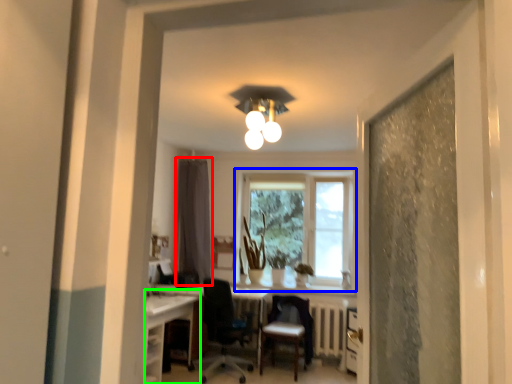
Question: Considering the real-world distances, which object is farthest from curtain (highlighted by a red box)? window (highlighted by a blue box) or computer desk (highlighted by a green box)?

Choices:
 (A) window
 (B) computer desk

Answer: (B)